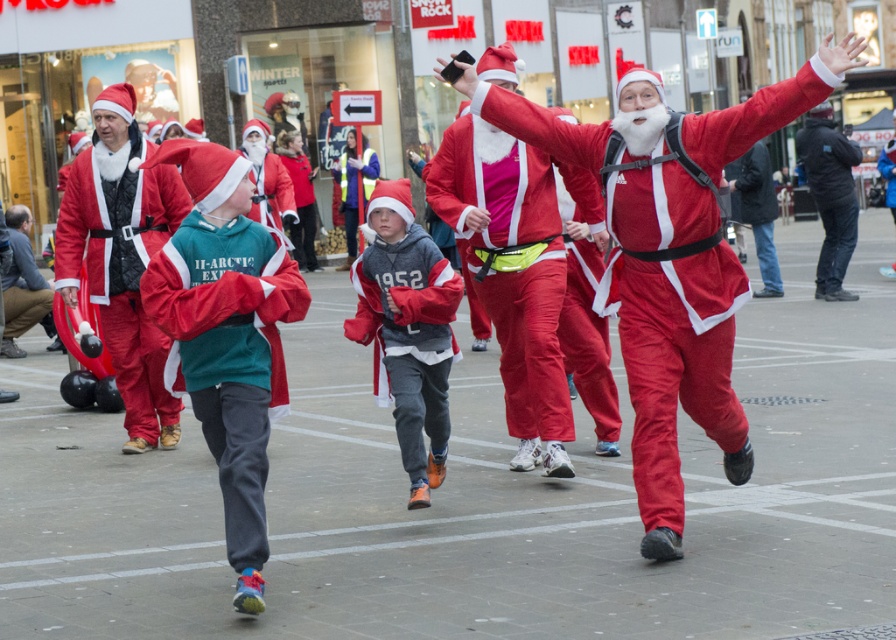
Question: Does matte red santa at center have a lesser width compared to black leather jacket at right?

Choices:
 (A) no
 (B) yes

Answer: (A)

Question: From the image, what is the correct spatial relationship of matte black coat at left in relation to gray fleece jacket at center?

Choices:
 (A) below
 (B) above

Answer: (B)

Question: Which of these objects is positioned farthest from the gray fleece jacket at center?

Choices:
 (A) matte black coat at left
 (B) black leather jacket at right
 (C) matte red santa suit at center

Answer: (B)

Question: Considering the real-world distances, which object is closest to the black leather jacket at right?

Choices:
 (A) matte black coat at left
 (B) matte red santa at center

Answer: (A)

Question: Is the position of matte red santa suit at center more distant than that of matte black coat at left?

Choices:
 (A) yes
 (B) no

Answer: (B)

Question: Estimate the real-world distances between objects in this image. Which object is farther from the matte red santa at center?

Choices:
 (A) gray fleece jacket at center
 (B) matte red santa suit at center
 (C) matte black coat at left

Answer: (C)